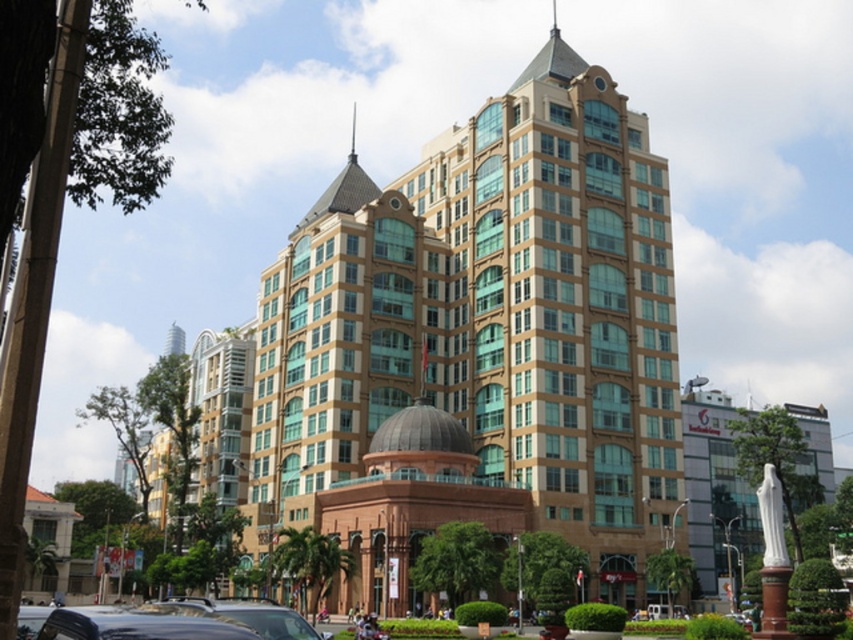
You are a photographer planning to capture the golden stone building at center and the shiny black car at lower left in a single frame. Based on their sizes, which object should you focus on to ensure both are clearly visible in the photo?

The golden stone building at center is larger than the shiny black car at lower left, so focusing on the golden stone building at center would ensure both are clearly visible as the car will be smaller in the frame.

You are standing in front of the building and want to take a photo of both the golden stone building at center and the shiny black car at lower left. Which object should you adjust your camera angle to look up or down to include both in the frame?

The golden stone building at center is above the shiny black car at lower left, so you should look down to include both in the frame.